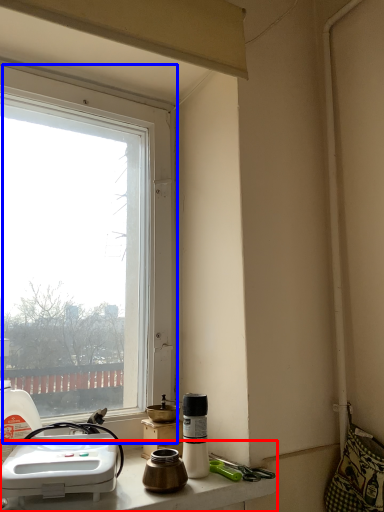
Question: Which object appears farthest to the camera in this image, counter top (highlighted by a red box) or window (highlighted by a blue box)?

Choices:
 (A) counter top
 (B) window

Answer: (B)